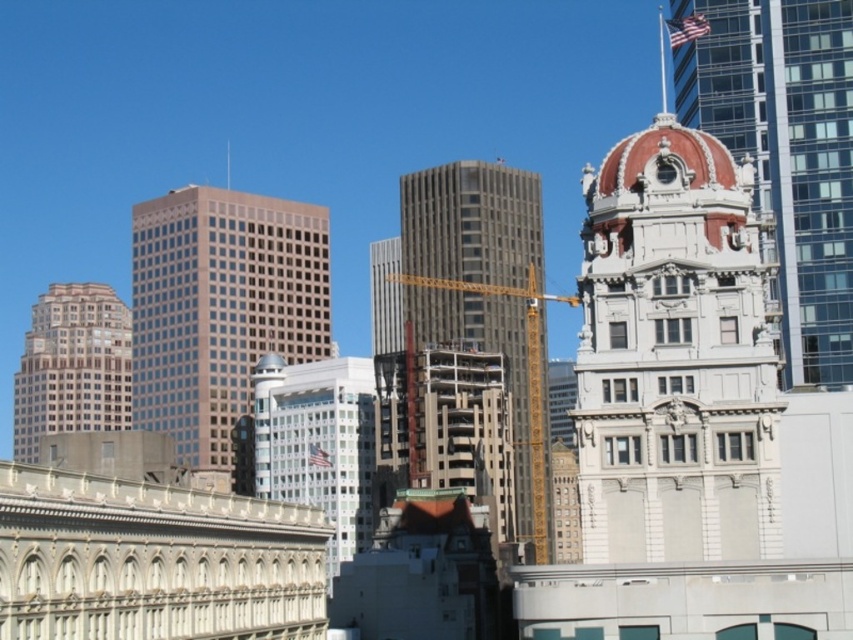
You are an urban planner assessing the city layout. You need to determine which of the two buildings, the gray concrete building at center or the beige glass skyscraper at left, takes up more horizontal space in the image. Based on the scene description, which building should you report as occupying a larger area?

The beige glass skyscraper at left occupies more horizontal space than the gray concrete building at center because the gray concrete building at center is described as occupying less space than the beige glass skyscraper at left.

You are an architect evaluating the urban layout. Given the scene described, which of the two buildings at the center has a greater width? The options are the matte glass skyscraper at center and the gray concrete building at center.

The matte glass skyscraper at center has a greater width than the gray concrete building at center according to the description.

You are a drone operator who needs to fly a drone from the matte glass skyscraper at center to the gray concrete building at center. Based on their positions in the scene, will the drone have an unobstructed path between them?

The gray concrete building at center is behind the matte glass skyscraper at center, so the drone will not have an unobstructed path between them as the matte glass skyscraper at center is blocking the way.